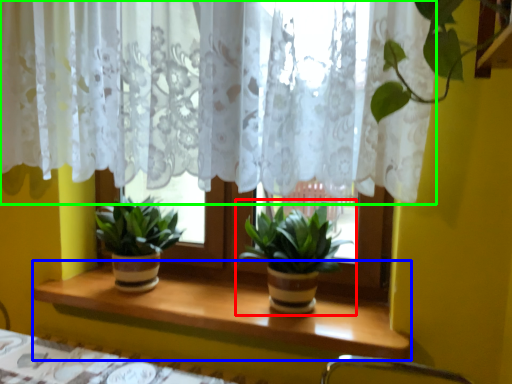
Question: Which object is positioned farthest from houseplant (highlighted by a red box)? Select from window sill (highlighted by a blue box) and curtain (highlighted by a green box).

Choices:
 (A) window sill
 (B) curtain

Answer: (B)